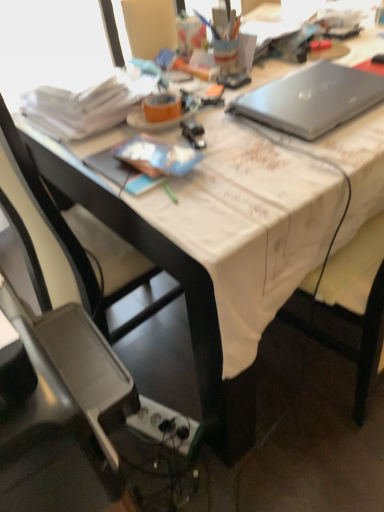
Question: In terms of height, does black plastic chair at lower left, which is the first chair from back to front, look taller or shorter compared to plastic gray chair at lower left, arranged as the first chair when viewed from the front?

Choices:
 (A) tall
 (B) short

Answer: (A)

Question: In the image, is black plastic chair at lower left, which is the first chair from back to front, on the left side or the right side of plastic gray chair at lower left, the 2th chair viewed from the back?

Choices:
 (A) right
 (B) left

Answer: (A)

Question: Estimate the real-world distances between objects in this image. Which object is closer to the metallic silver stapler at center?

Choices:
 (A) white plastic power outlet at lower center
 (B) black plastic chair at lower left, which appears as the 2th chair when viewed from the front
 (C) silver metallic laptop at upper right
 (D) plastic gray chair at lower left, arranged as the first chair when viewed from the front

Answer: (C)

Question: Estimate the real-world distances between objects in this image. Which object is closer to the metallic silver stapler at center?

Choices:
 (A) silver metallic laptop at upper right
 (B) plastic gray chair at lower left, arranged as the first chair when viewed from the front
 (C) white plastic power outlet at lower center
 (D) black plastic chair at lower left, which is the first chair from back to front

Answer: (A)